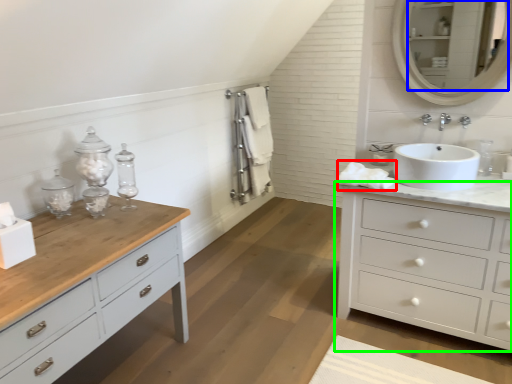
Question: Based on their relative distances, which object is nearer to bath towel (highlighted by a red box)? Choose from mirror (highlighted by a blue box) and chest of drawers (highlighted by a green box).

Choices:
 (A) mirror
 (B) chest of drawers

Answer: (B)